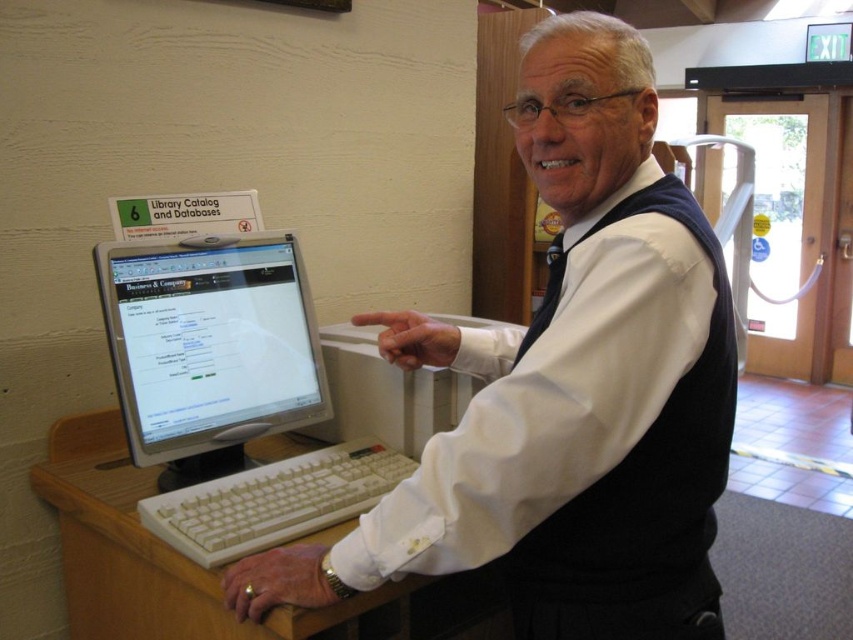
Question: Observing the image, what is the correct spatial positioning of white matte shirt at center in reference to white plastic keyboard at lower center?

Choices:
 (A) right
 (B) left

Answer: (A)

Question: Does white glossy monitor at center appear on the left side of white plastic keyboard at lower center?

Choices:
 (A) no
 (B) yes

Answer: (B)

Question: Which point is farther to the camera?

Choices:
 (A) white matte shirt at center
 (B) white plastic keyboard at lower center

Answer: (B)

Question: Estimate the real-world distances between objects in this image. Which object is farther from the white plastic keyboard at lower center?

Choices:
 (A) white matte shirt at center
 (B) white glossy monitor at center

Answer: (A)

Question: Can you confirm if white glossy monitor at center is thinner than white plastic keyboard at lower center?

Choices:
 (A) no
 (B) yes

Answer: (B)

Question: Based on their relative distances, which object is nearer to the white glossy monitor at center?

Choices:
 (A) white plastic keyboard at lower center
 (B) white matte shirt at center

Answer: (A)